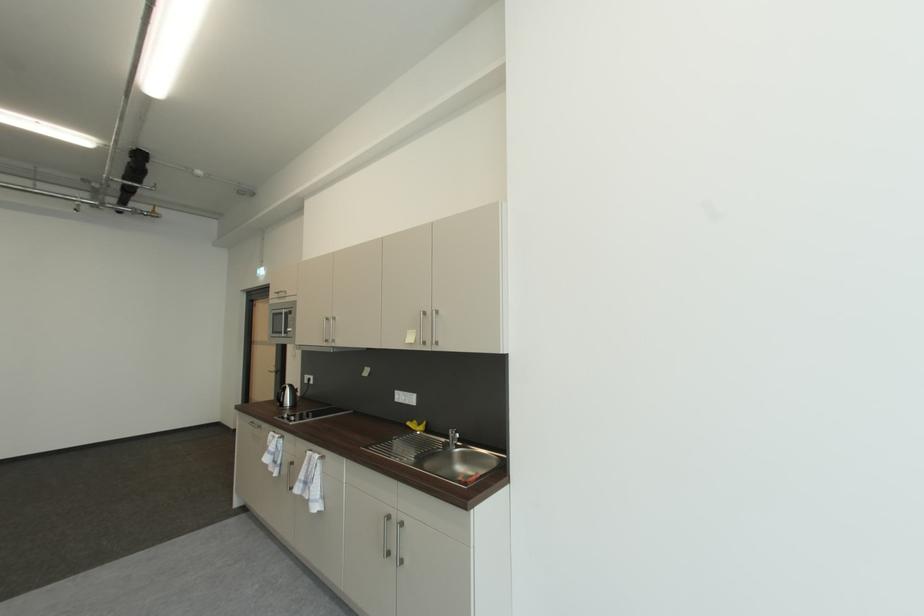
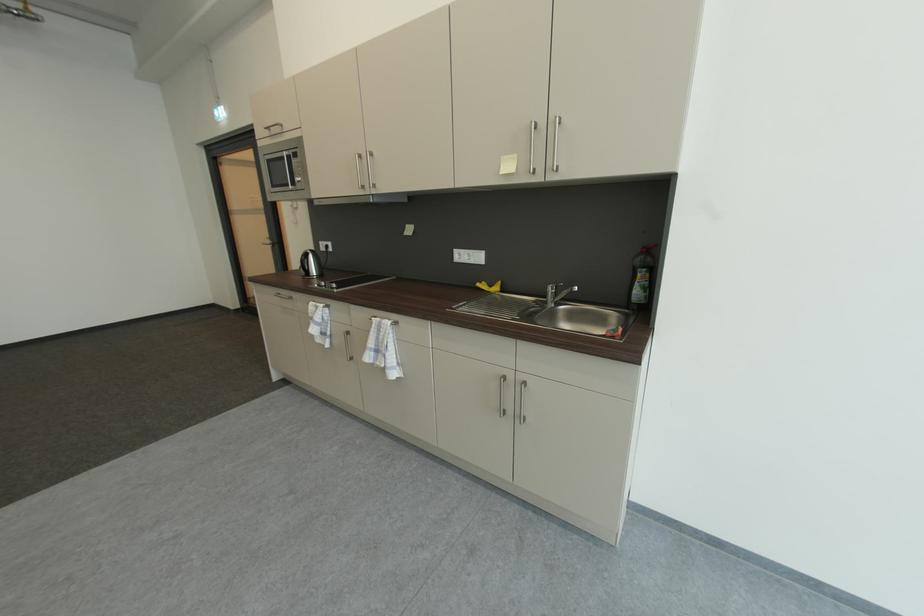
Find the pixel in the second image that matches [282,294] in the first image.

(273, 130)